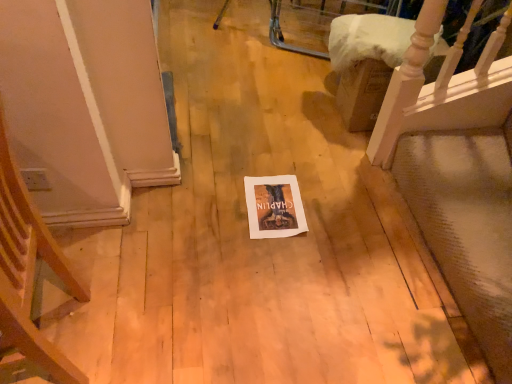
Question: Based on their positions, is wooden armchair at left located to the left or right of wooden staircase at upper right?

Choices:
 (A) left
 (B) right

Answer: (A)

Question: From the image's perspective, is wooden armchair at left positioned above or below wooden staircase at upper right?

Choices:
 (A) above
 (B) below

Answer: (B)

Question: Considering the real-world distances, which object is closest to the white paper at center?

Choices:
 (A) wooden armchair at left
 (B) wooden staircase at upper right

Answer: (B)

Question: Which of these objects is positioned closest to the wooden armchair at left?

Choices:
 (A) white paper at center
 (B) wooden staircase at upper right

Answer: (A)